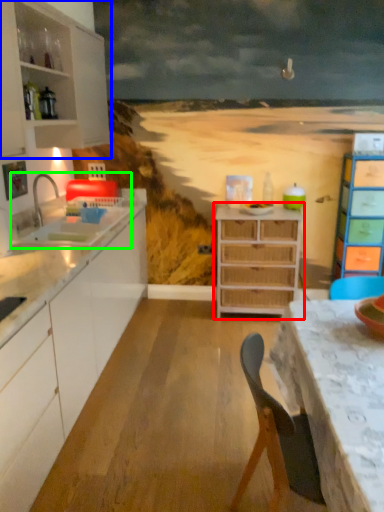
Question: Which object is the farthest from chest of drawers (highlighted by a red box)? Choose among these: cabinetry (highlighted by a blue box) or sink (highlighted by a green box).

Choices:
 (A) cabinetry
 (B) sink

Answer: (A)